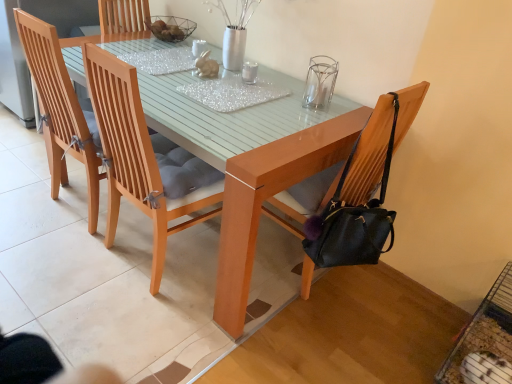
Question: Does light brown wooden chair at center, arranged as the 2th chair when viewed from the right, have a greater width compared to transparent glass candle holder at upper center?

Choices:
 (A) yes
 (B) no

Answer: (A)

Question: Considering the relative sizes of light brown wooden chair at center, which is counted as the third chair, starting from the left, and transparent glass candle holder at upper center in the image provided, is light brown wooden chair at center, which is counted as the third chair, starting from the left, taller than transparent glass candle holder at upper center?

Choices:
 (A) no
 (B) yes

Answer: (B)

Question: Is light brown wooden chair at center, arranged as the 2th chair when viewed from the right, surrounding transparent glass candle holder at upper center?

Choices:
 (A) no
 (B) yes

Answer: (A)

Question: From a real-world perspective, is light brown wooden chair at center, which is counted as the third chair, starting from the left, physically above transparent glass candle holder at upper center?

Choices:
 (A) no
 (B) yes

Answer: (A)

Question: From the image's perspective, is light brown wooden chair at center, which is counted as the third chair, starting from the left, over transparent glass candle holder at upper center?

Choices:
 (A) yes
 (B) no

Answer: (B)

Question: Considering the relative sizes of light brown wooden chair at center, arranged as the 2th chair when viewed from the right, and transparent glass candle holder at upper center in the image provided, is light brown wooden chair at center, arranged as the 2th chair when viewed from the right, smaller than transparent glass candle holder at upper center?

Choices:
 (A) yes
 (B) no

Answer: (B)

Question: Is light brown wooden chair at center, arranged as the 2th chair when viewed from the right, next to black leather chair at right, placed as the first chair when sorted from right to left?

Choices:
 (A) no
 (B) yes

Answer: (A)

Question: Considering the relative sizes of light brown wooden chair at center, which is counted as the third chair, starting from the left, and black leather chair at right, placed as the first chair when sorted from right to left, in the image provided, is light brown wooden chair at center, which is counted as the third chair, starting from the left, taller than black leather chair at right, placed as the first chair when sorted from right to left,?

Choices:
 (A) no
 (B) yes

Answer: (A)

Question: From the image's perspective, is light brown wooden chair at center, arranged as the 2th chair when viewed from the right, under black leather chair at right, placed as the first chair when sorted from right to left?

Choices:
 (A) no
 (B) yes

Answer: (A)

Question: From the image's perspective, is light brown wooden chair at center, which is counted as the third chair, starting from the left, above black leather chair at right, which appears as the fourth chair when viewed from the left?

Choices:
 (A) yes
 (B) no

Answer: (A)

Question: From a real-world perspective, is light brown wooden chair at center, arranged as the 2th chair when viewed from the right, located beneath black leather chair at right, which appears as the fourth chair when viewed from the left?

Choices:
 (A) no
 (B) yes

Answer: (B)

Question: Is light brown wooden chair at center, arranged as the 2th chair when viewed from the right, at the left side of black leather chair at right, which appears as the fourth chair when viewed from the left?

Choices:
 (A) no
 (B) yes

Answer: (B)

Question: Can you confirm if black leather chair at right, which appears as the fourth chair when viewed from the left, is taller than light brown wooden chair at center, arranged as the 2th chair when viewed from the right?

Choices:
 (A) yes
 (B) no

Answer: (A)